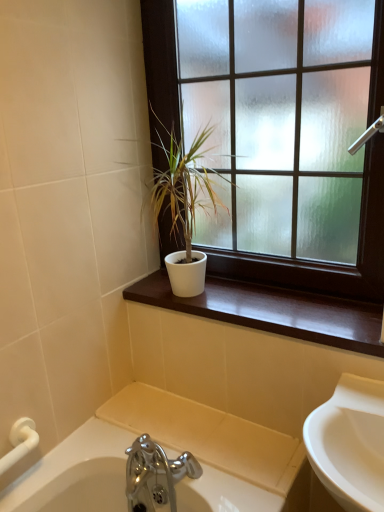
Question: Considering the relative sizes of white matte window at upper center and white matte pot at center in the image provided, is white matte window at upper center taller than white matte pot at center?

Choices:
 (A) no
 (B) yes

Answer: (B)

Question: Would you say white matte window at upper center is outside white matte pot at center?

Choices:
 (A) yes
 (B) no

Answer: (A)

Question: From a real-world perspective, is white matte window at upper center beneath white matte pot at center?

Choices:
 (A) yes
 (B) no

Answer: (B)

Question: Considering the relative positions of white matte window at upper center and white matte pot at center in the image provided, is white matte window at upper center in front of white matte pot at center?

Choices:
 (A) no
 (B) yes

Answer: (B)

Question: Can you confirm if white matte window at upper center is thinner than white matte pot at center?

Choices:
 (A) no
 (B) yes

Answer: (B)

Question: From a real-world perspective, is white glossy window sill at center above or below white matte pot at center?

Choices:
 (A) below
 (B) above

Answer: (A)

Question: Visually, is white glossy window sill at center positioned to the left or to the right of white matte pot at center?

Choices:
 (A) right
 (B) left

Answer: (A)

Question: Choose the correct answer: Is white glossy window sill at center inside white matte pot at center or outside it?

Choices:
 (A) outside
 (B) inside

Answer: (A)

Question: In terms of height, does white glossy window sill at center look taller or shorter compared to white matte pot at center?

Choices:
 (A) tall
 (B) short

Answer: (B)

Question: Looking at the image, does white matte window at upper center seem bigger or smaller compared to white matte pot at center?

Choices:
 (A) big
 (B) small

Answer: (A)

Question: Is white matte window at upper center wider or thinner than white matte pot at center?

Choices:
 (A) thin
 (B) wide

Answer: (A)

Question: Do you think white matte window at upper center is within white matte pot at center, or outside of it?

Choices:
 (A) inside
 (B) outside

Answer: (A)

Question: In terms of height, does white matte window at upper center look taller or shorter compared to white matte pot at center?

Choices:
 (A) tall
 (B) short

Answer: (A)

Question: From a real-world perspective, is white glossy window sill at center positioned above or below white matte window at upper center?

Choices:
 (A) below
 (B) above

Answer: (A)

Question: Is white glossy window sill at center taller or shorter than white matte window at upper center?

Choices:
 (A) tall
 (B) short

Answer: (B)